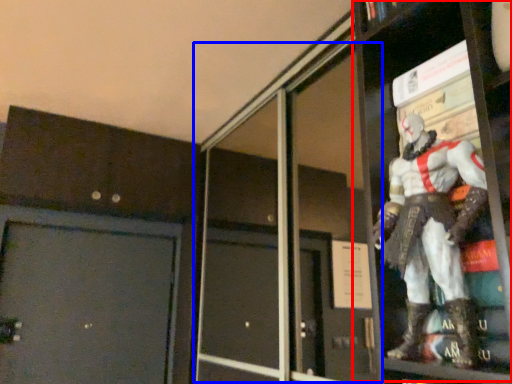
Question: Which of the following is the farthest to the observer, shelf (highlighted by a red box) or screen door (highlighted by a blue box)?

Choices:
 (A) shelf
 (B) screen door

Answer: (B)